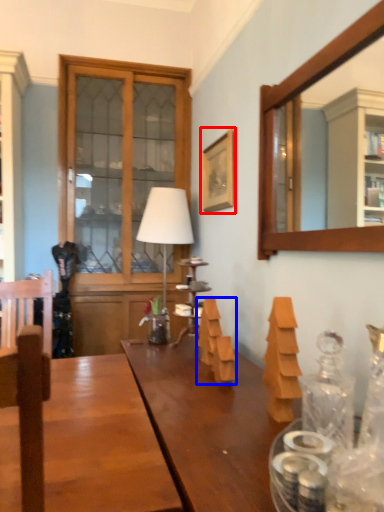
Question: Which of the following is the closest to the observer, picture frame (highlighted by a red box) or wood (highlighted by a blue box)?

Choices:
 (A) picture frame
 (B) wood

Answer: (B)